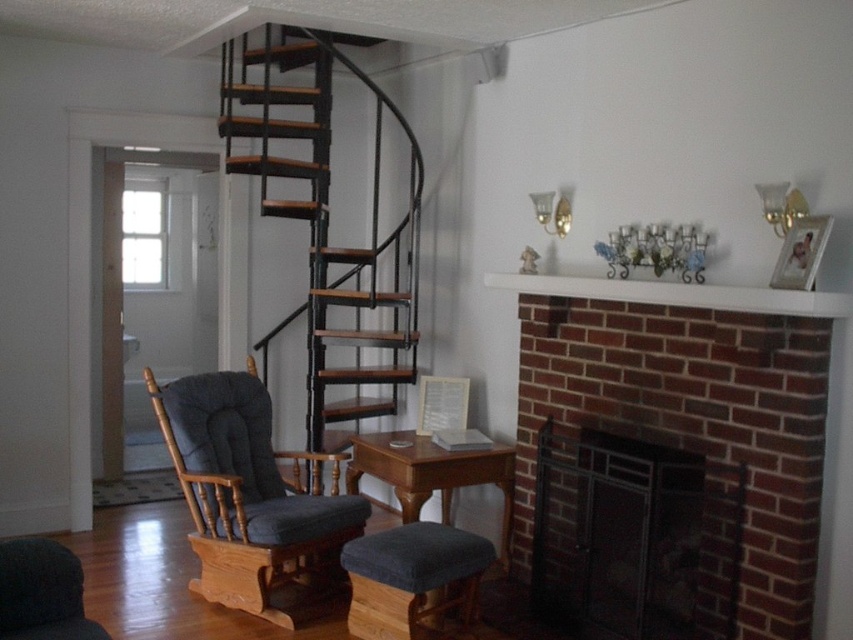
Consider the image. Can you confirm if brick fireplace at center is taller than dark gray fabric stool at lower center?

Yes.

Does brick fireplace at center appear over dark gray fabric stool at lower center?

Indeed, brick fireplace at center is positioned over dark gray fabric stool at lower center.

The width and height of the screenshot is (853, 640). I want to click on brick fireplace at center, so click(x=693, y=404).

Who is higher up, brick fireplace at center or black metal fireplace at lower right?

brick fireplace at center is higher up.

Does brick fireplace at center have a greater width compared to black metal fireplace at lower right?

Indeed, brick fireplace at center has a greater width compared to black metal fireplace at lower right.

Identify the location of brick fireplace at center. (693, 404).

Can you confirm if black metal stairs at center is positioned to the left of wooden table at center?

Indeed, black metal stairs at center is positioned on the left side of wooden table at center.

Does black metal stairs at center come in front of wooden table at center?

No, it is not.

Which is in front, point (329, 145) or point (401, 522)?

Point (401, 522)

Locate an element on the screen. black metal stairs at center is located at coordinates (328, 221).